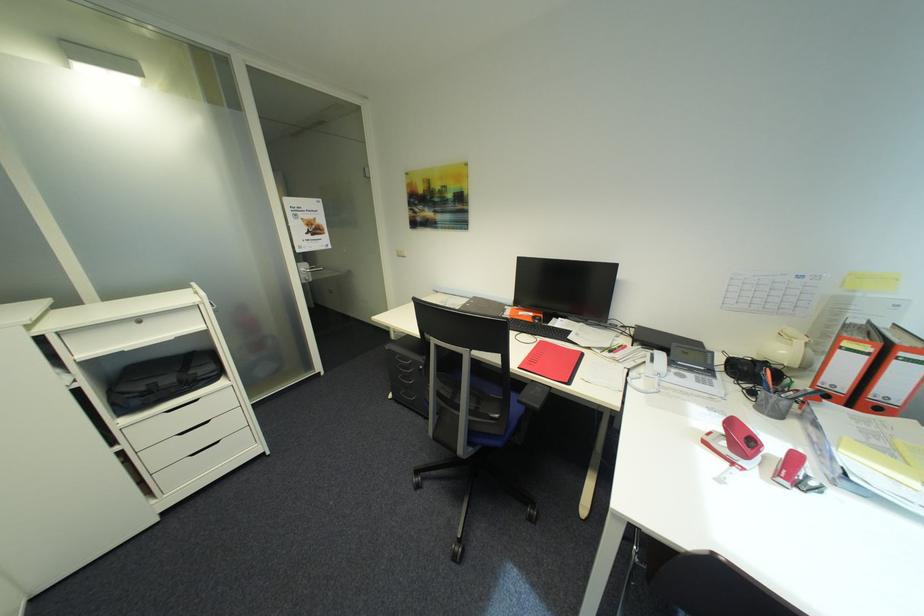
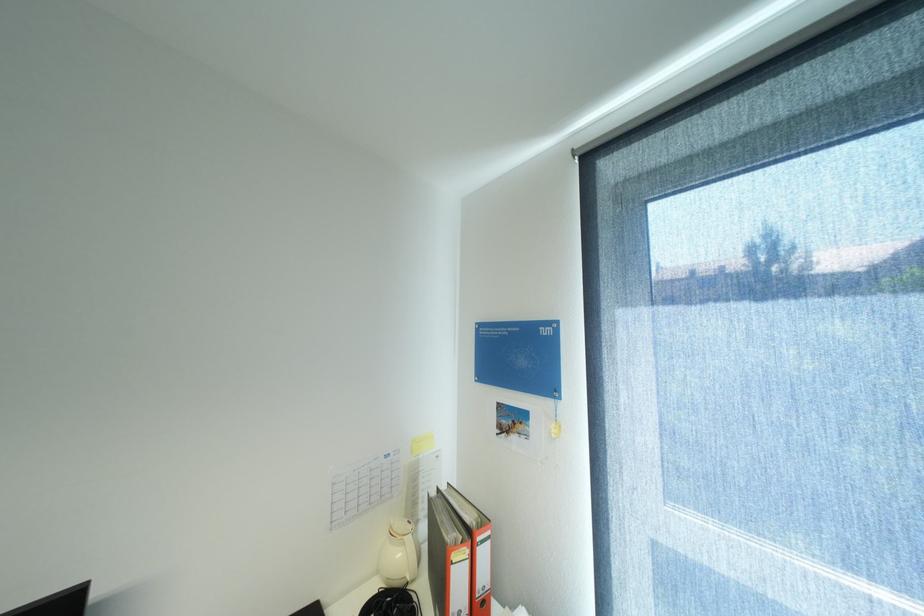
Find the pixel in the second image that matches pixel 793 353 in the first image.

(407, 554)